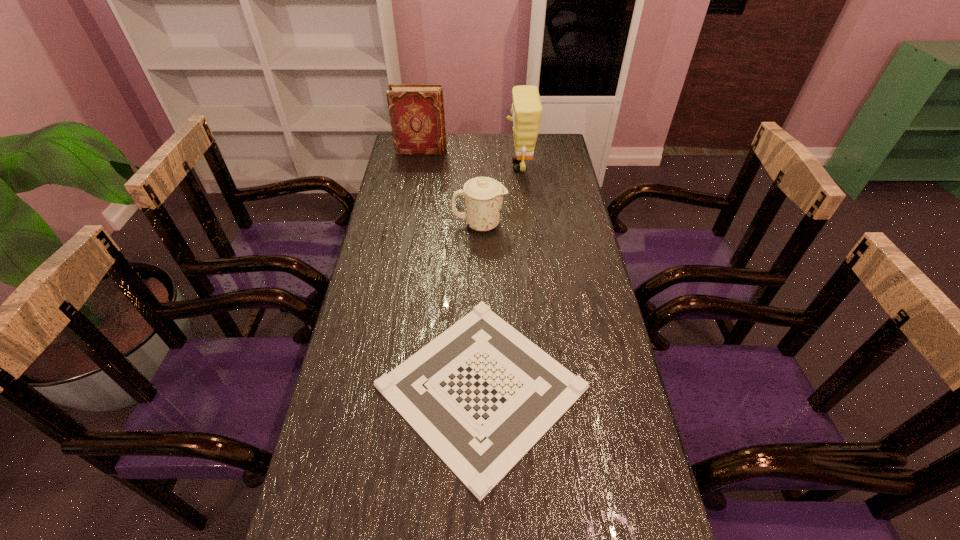
Find the location of `free space at the left edge of the desktop`. free space at the left edge of the desktop is located at coordinates (358, 417).

The width and height of the screenshot is (960, 540). I want to click on free space at the right edge of the desktop, so click(x=586, y=247).

At what (x,y) coordinates should I click in order to perform the action: click on free space at the far right corner of the desktop. Please return your answer as a coordinate pair (x, y). Image resolution: width=960 pixels, height=540 pixels. Looking at the image, I should click on (559, 162).

At what (x,y) coordinates should I click in order to perform the action: click on free spot between the hardback book and the third tallest object. Please return your answer as a coordinate pair (x, y). This screenshot has width=960, height=540. Looking at the image, I should click on (450, 188).

The height and width of the screenshot is (540, 960). Find the location of `vacant region between the checkerboard and the sponge`. vacant region between the checkerboard and the sponge is located at coordinates (500, 276).

Identify which object is the second closest to the sponge. Please provide its 2D coordinates. Your answer should be formatted as a tuple, i.e. [(x, y)], where the tuple contains the x and y coordinates of a point satisfying the conditions above.

[(416, 111)]

At what (x,y) coordinates should I click in order to perform the action: click on object that stands as the closest to the hardback book. Please return your answer as a coordinate pair (x, y). Looking at the image, I should click on (526, 110).

The image size is (960, 540). What are the coordinates of `free space that satisfies the following two spatial constraints: 1. on the spout of the chinaware; 2. on the back side of the checkerboard` in the screenshot? It's located at (480, 387).